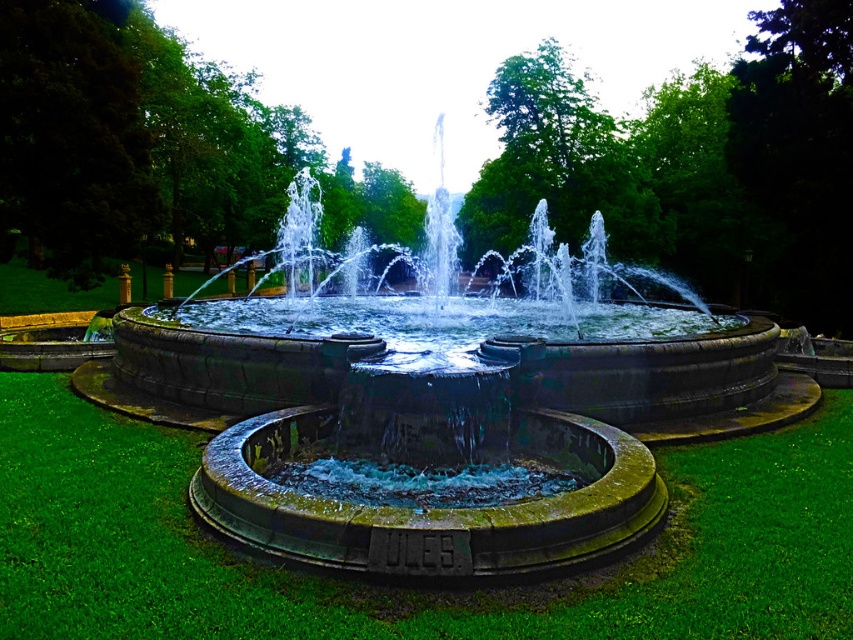
Question: Observing the image, what is the correct spatial positioning of green stone fountain at center in reference to green mossy grass at center?

Choices:
 (A) right
 (B) left

Answer: (B)

Question: Is green stone fountain at center wider than green mossy grass at center?

Choices:
 (A) no
 (B) yes

Answer: (B)

Question: Which point is closer to the camera taking this photo?

Choices:
 (A) (515, 404)
 (B) (397, 604)

Answer: (B)

Question: In this image, where is green stone fountain at center located relative to green mossy grass at center?

Choices:
 (A) right
 (B) left

Answer: (B)

Question: Among these points, which one is farthest from the camera?

Choices:
 (A) (267, 305)
 (B) (792, 634)

Answer: (A)